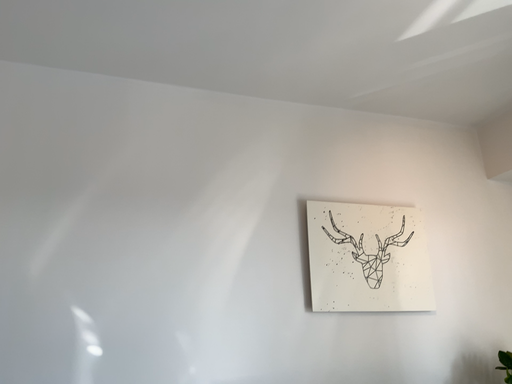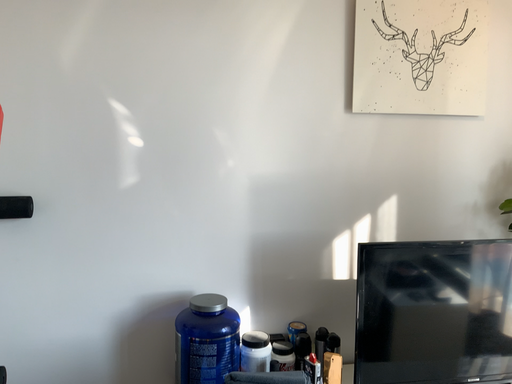
Question: Which way did the camera rotate in the video?

Choices:
 (A) rotated downward
 (B) rotated upward

Answer: (A)